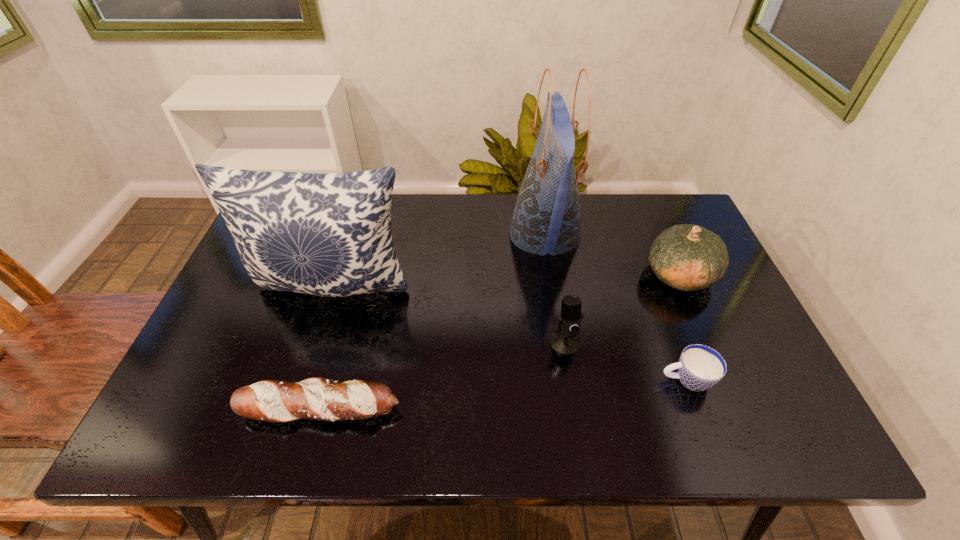
This screenshot has height=540, width=960. In order to click on unoccupied position between the baguet and the fifth shortest object in this screenshot , I will do `click(327, 348)`.

At what (x,y) coordinates should I click in order to perform the action: click on empty space that is in between the fifth shortest object and the baguet. Please return your answer as a coordinate pair (x, y). The width and height of the screenshot is (960, 540). Looking at the image, I should click on (327, 348).

Locate an element on the screen. vacant region between the gourd and the cup is located at coordinates (683, 327).

Identify the location of blank region between the tallest object and the third nearest object. The image size is (960, 540). (555, 288).

Find the location of a particular element. This screenshot has width=960, height=540. free space between the cup and the second tallest object is located at coordinates (510, 334).

Locate which object is the third closest to the gourd. Please provide its 2D coordinates. Your answer should be formatted as a tuple, i.e. [(x, y)], where the tuple contains the x and y coordinates of a point satisfying the conditions above.

[(565, 340)]

What are the coordinates of `object that is the closest one to the baguet` in the screenshot? It's located at (328, 234).

The height and width of the screenshot is (540, 960). I want to click on vacant space that satisfies the following two spatial constraints: 1. on the front surface of the baguet; 2. on the right side of the cushion, so click(x=297, y=408).

This screenshot has height=540, width=960. I want to click on free space that satisfies the following two spatial constraints: 1. on the front surface of the cushion; 2. on the right side of the baguet, so click(x=297, y=408).

You are a GUI agent. You are given a task and a screenshot of the screen. Output one action in this format:
    pyautogui.click(x=<x>, y=<y>)
    Task: Click on the vacant space that satisfies the following two spatial constraints: 1. on the front surface of the fifth shortest object; 2. on the right side of the baguet
    Image resolution: width=960 pixels, height=540 pixels.
    Given the screenshot: What is the action you would take?
    297,408